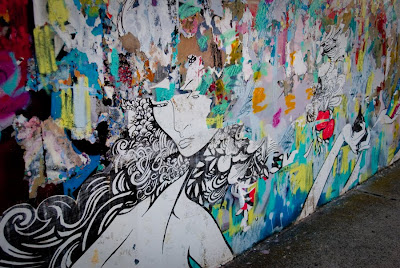
Find the location of a particular element. The width and height of the screenshot is (400, 268). bare wall is located at coordinates (187, 43).